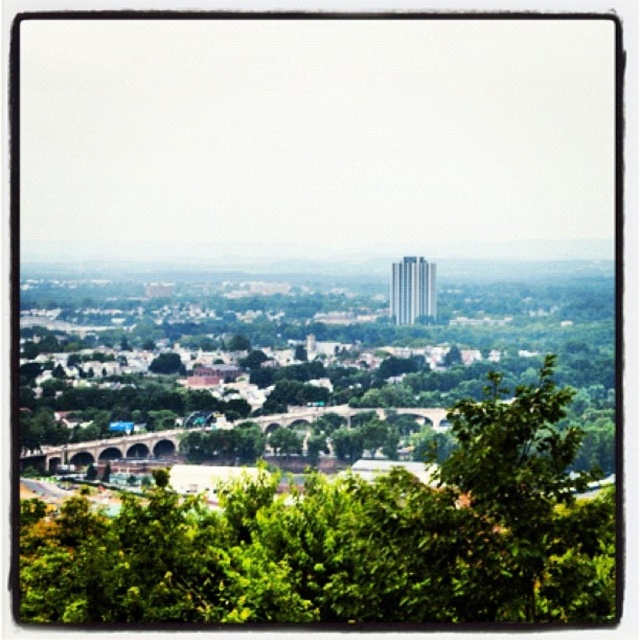
You are standing at the viewpoint overlooking the city. You see two green leafy trees in the scene. Which one is closer to you, the green leafy tree at center or the green leafy tree at lower right?

The green leafy tree at center is closer to the viewer than the green leafy tree at lower right.

Consider the image. You are a bird looking for a place to perch. You see two green leafy trees in the scene. Which tree, the green leafy tree at center or the green leafy tree at lower right, would you choose if you want to land on the wider tree?

The green leafy tree at center might be wider than green leafy tree at lower right, so you should choose the green leafy tree at center.

You are a bird looking for a higher perch. You see two green leafy trees in the cityscape image. Which tree should you choose between the green leafy tree at center and the green leafy tree at lower right?

The green leafy tree at center has a greater height compared to the green leafy tree at lower right, so you should choose the green leafy tree at center for a higher perch.